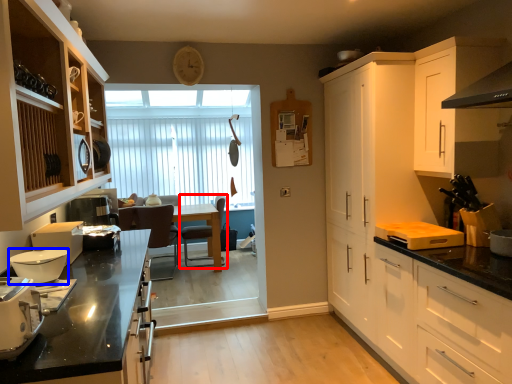
Question: Which point is closer to the camera, chair (highlighted by a red box) or kitchen appliance (highlighted by a blue box)?

Choices:
 (A) chair
 (B) kitchen appliance

Answer: (B)